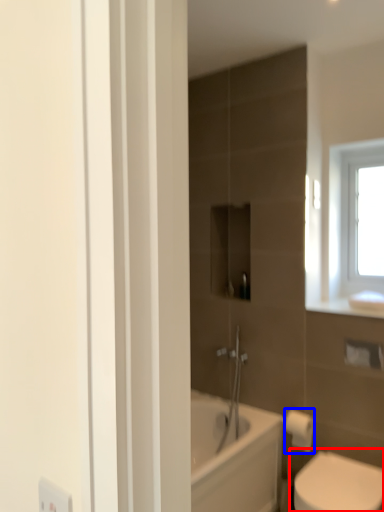
Question: Which point is closer to the camera, toilet (highlighted by a red box) or toilet paper (highlighted by a blue box)?

Choices:
 (A) toilet
 (B) toilet paper

Answer: (A)